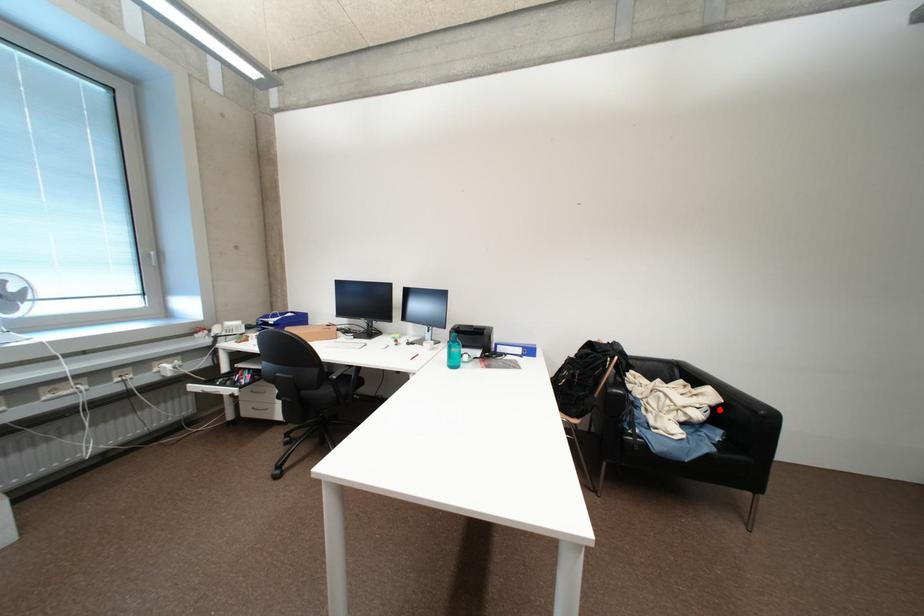
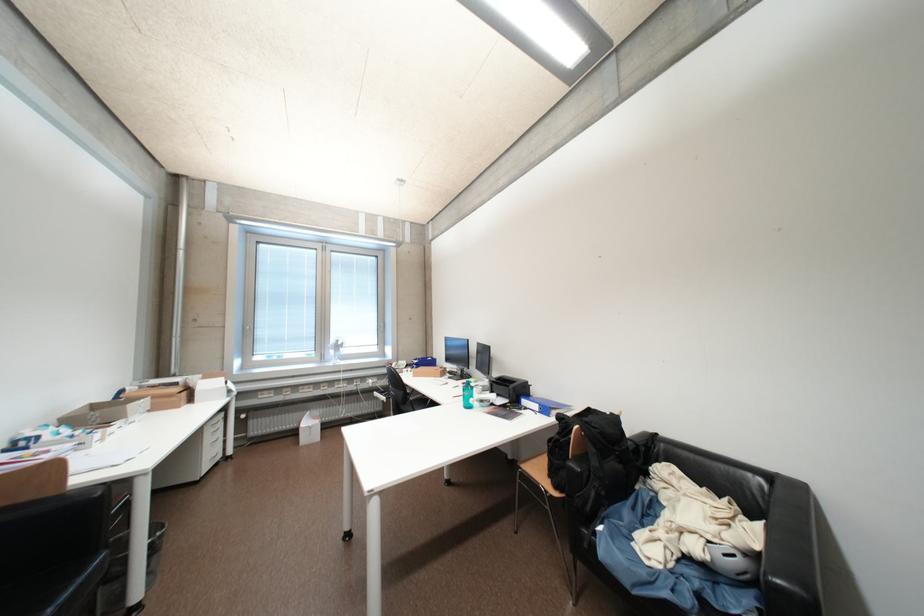
The point at the highlighted location is marked in the first image. Where is the corresponding point in the second image?

(751, 556)